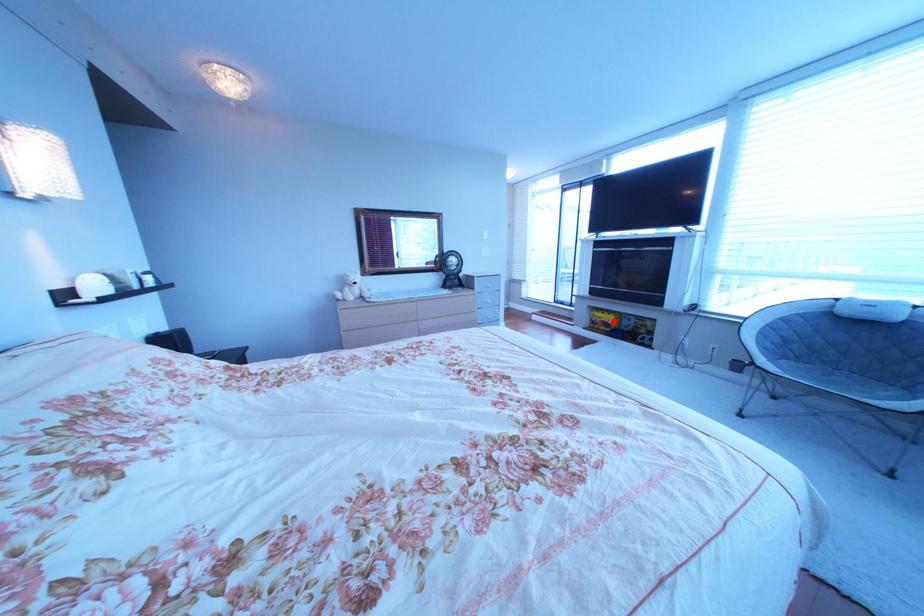
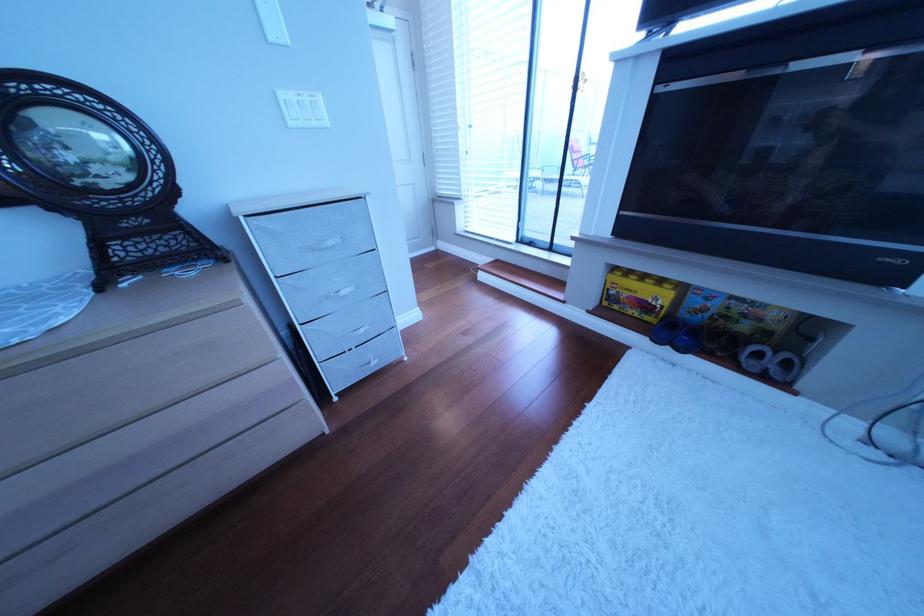
Question: I am providing you with two images of the same scene from different viewpoints. In image1, a red point is highlighted. Considering the same 3D point in image2, which of the following is correct?

Choices:
 (A) It is closer
 (B) It is farther

Answer: (A)